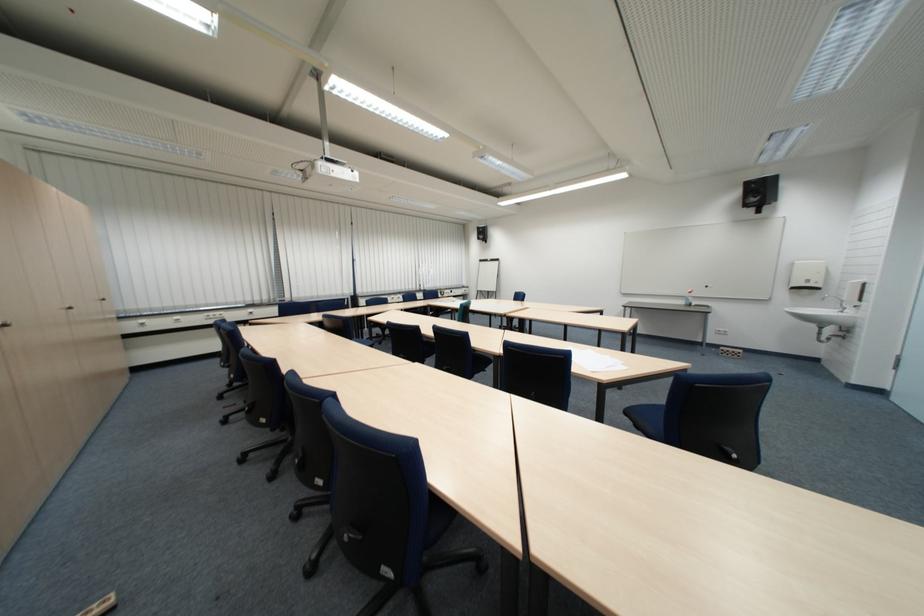
This screenshot has height=616, width=924. In order to click on blue chair sitting surface in this screenshot , I will do `click(646, 416)`.